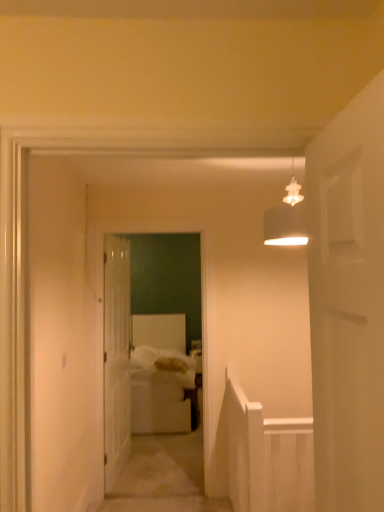
Question: Does matte white lampshade at upper center turn towards white glossy door at center?

Choices:
 (A) no
 (B) yes

Answer: (A)

Question: From a real-world perspective, does matte white lampshade at upper center stand above white glossy door at center?

Choices:
 (A) no
 (B) yes

Answer: (B)

Question: From a real-world perspective, is matte white lampshade at upper center beneath white glossy door at center?

Choices:
 (A) no
 (B) yes

Answer: (A)

Question: Does matte white lampshade at upper center have a larger size compared to white glossy door at center?

Choices:
 (A) yes
 (B) no

Answer: (B)

Question: From the image's perspective, does matte white lampshade at upper center appear lower than white glossy door at center?

Choices:
 (A) yes
 (B) no

Answer: (B)

Question: Is white glossy door at center wider or thinner than white soft bedsheet at center?

Choices:
 (A) thin
 (B) wide

Answer: (A)

Question: Does point (130, 320) appear closer or farther from the camera than point (132, 374)?

Choices:
 (A) farther
 (B) closer

Answer: (A)

Question: Is white glossy door at center inside the boundaries of white soft bedsheet at center, or outside?

Choices:
 (A) outside
 (B) inside

Answer: (A)

Question: Considering the relative positions of white glossy door at center and white soft bedsheet at center in the image provided, is white glossy door at center to the left or to the right of white soft bedsheet at center?

Choices:
 (A) right
 (B) left

Answer: (B)

Question: Would you say white glossy door at center is inside or outside white soft bed at center?

Choices:
 (A) outside
 (B) inside

Answer: (A)

Question: Is point (114, 332) closer or farther from the camera than point (183, 354)?

Choices:
 (A) closer
 (B) farther

Answer: (A)

Question: Is white glossy door at center taller or shorter than white soft bed at center?

Choices:
 (A) tall
 (B) short

Answer: (A)

Question: From a real-world perspective, is white glossy door at center above or below white soft bed at center?

Choices:
 (A) above
 (B) below

Answer: (A)

Question: In terms of height, does white soft bed at center look taller or shorter compared to white soft bed at center?

Choices:
 (A) tall
 (B) short

Answer: (A)

Question: Looking at their shapes, would you say white soft bed at center is wider or thinner than white soft bed at center?

Choices:
 (A) thin
 (B) wide

Answer: (A)